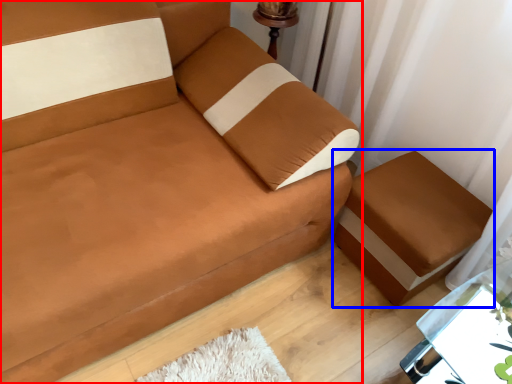
Question: Among these objects, which one is nearest to the camera, studio couch (highlighted by a red box) or furniture (highlighted by a blue box)?

Choices:
 (A) studio couch
 (B) furniture

Answer: (A)